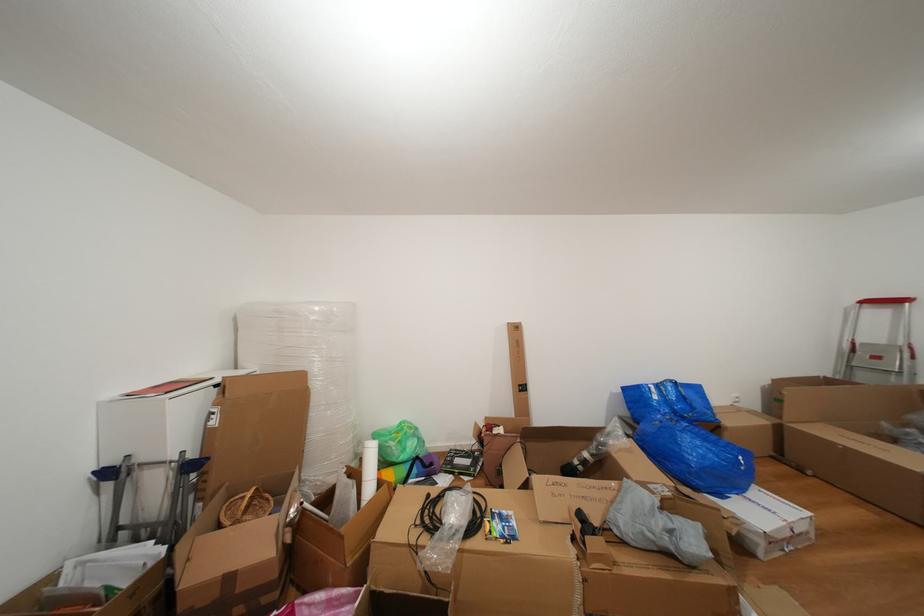
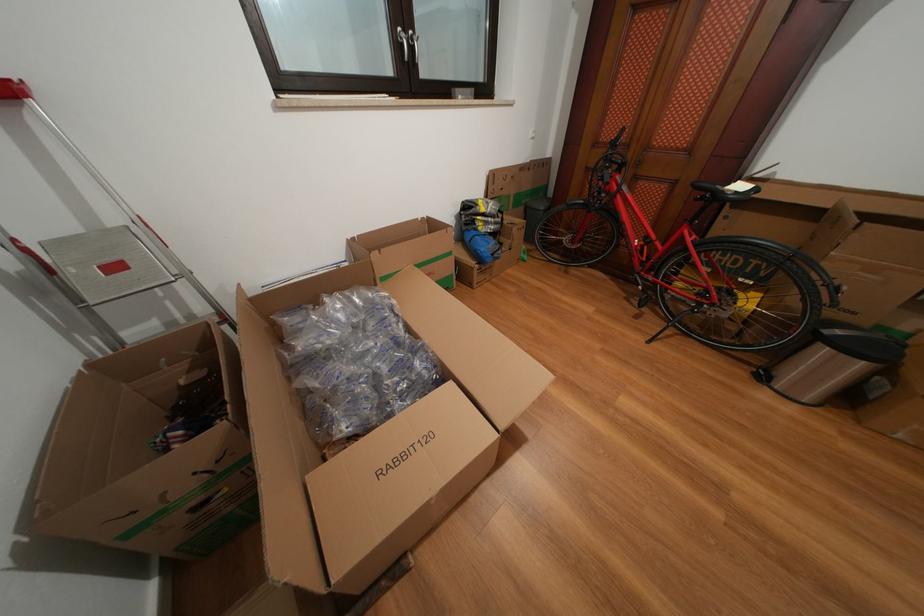
Locate, in the second image, the point that corresponds to (x=884, y=363) in the first image.

(124, 273)